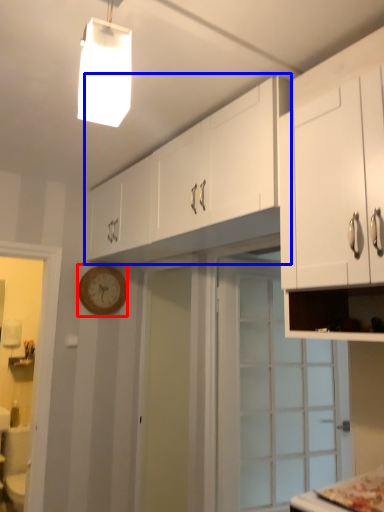
Question: Which object is closer to the camera taking this photo, clock (highlighted by a red box) or cabinetry (highlighted by a blue box)?

Choices:
 (A) clock
 (B) cabinetry

Answer: (B)